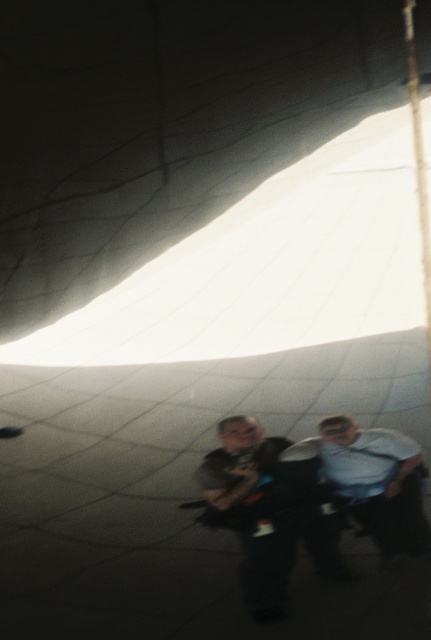
Can you confirm if matte black backpack at center is positioned to the right of light blue shirt at center?

Incorrect, matte black backpack at center is not on the right side of light blue shirt at center.

Is point (402, 445) positioned before point (412, 545)?

That is False.

Is point (302, 481) in front of point (371, 524)?

That is False.

This screenshot has width=431, height=640. What are the coordinates of `matte black backpack at center` in the screenshot? It's located at (265, 515).